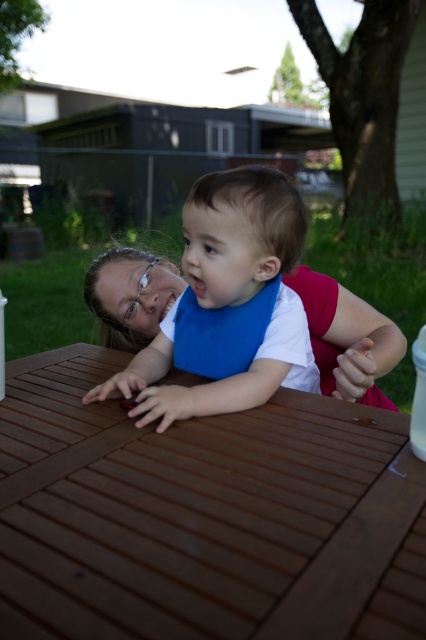
Does brown wooden table at center appear on the left side of blue fabric bib at center?

Correct, you'll find brown wooden table at center to the left of blue fabric bib at center.

Measure the distance between point (360, 540) and camera.

The distance of point (360, 540) from camera is 16.85 inches.

Is point (19, 397) closer to camera compared to point (296, 356)?

Yes, it is.

The height and width of the screenshot is (640, 426). Identify the location of brown wooden table at center. (203, 516).